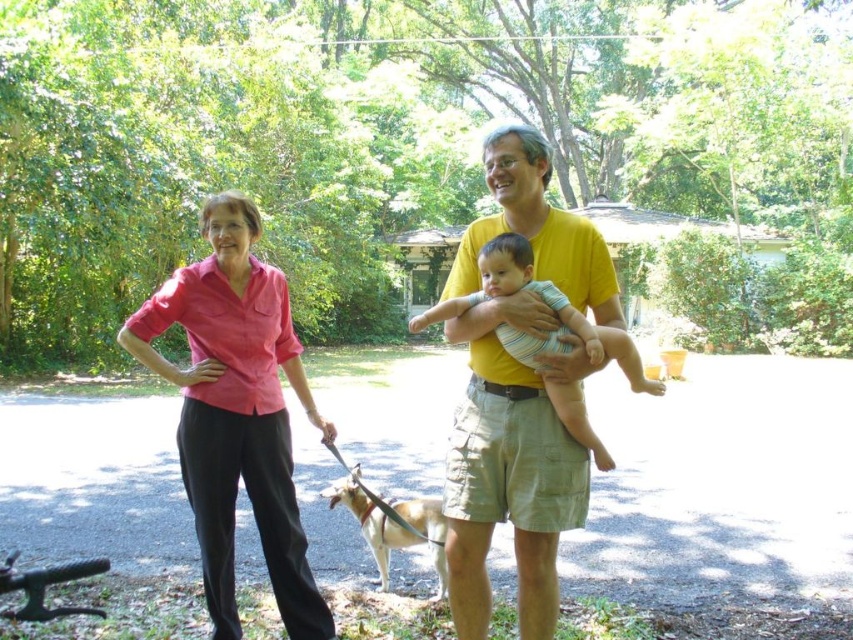
Question: Which object is the farthest from the striped cotton baby at center?

Choices:
 (A) pink cotton shirt at upper left
 (B) light brown fur at lower center

Answer: (B)

Question: Does yellow cotton shirt at center appear on the left side of pink linen shirt at left?

Choices:
 (A) no
 (B) yes

Answer: (A)

Question: Which of these objects is positioned farthest from the pink cotton shirt at upper left?

Choices:
 (A) light brown fur at lower center
 (B) pink linen shirt at left

Answer: (A)

Question: Estimate the real-world distances between objects in this image. Which object is farther from the pink cotton shirt at upper left?

Choices:
 (A) pink linen shirt at left
 (B) light brown fur at lower center
 (C) yellow cotton shirt at center
 (D) striped cotton baby at center

Answer: (B)

Question: Considering the relative positions of pink cotton shirt at upper left and light brown fur at lower center in the image provided, where is pink cotton shirt at upper left located with respect to light brown fur at lower center?

Choices:
 (A) right
 (B) left

Answer: (A)

Question: Can you confirm if pink cotton shirt at upper left is thinner than striped cotton baby at center?

Choices:
 (A) no
 (B) yes

Answer: (A)